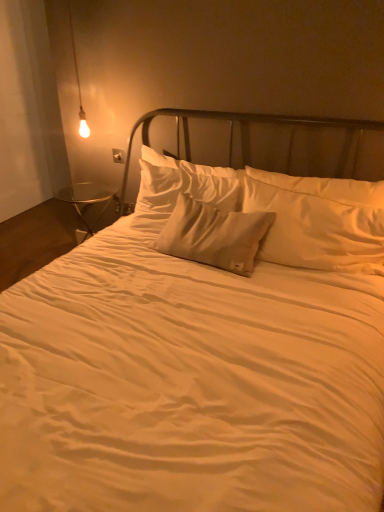
Find the location of a particular element. satin beige pillow at center, placed as the second pillow when sorted from back to front is located at coordinates (288, 212).

Image resolution: width=384 pixels, height=512 pixels. I want to click on matte plastic electric outlet at lower left, the 2th electric outlet viewed from the front, so click(128, 208).

How much space does white plastic electric outlet at upper left, which is the 1th electric outlet from front to back, occupy horizontally?

white plastic electric outlet at upper left, which is the 1th electric outlet from front to back, is 1.17 inches in width.

This screenshot has height=512, width=384. What are the coordinates of `white plastic electric outlet at upper left, the 2th electric outlet from the bottom` in the screenshot? It's located at (118, 156).

I want to click on matte glass bulb at upper left, so click(x=78, y=82).

Can you confirm if matte plastic electric outlet at lower left, the second electric outlet from the top, is bigger than satin beige pillow at center, placed as the second pillow when sorted from back to front?

No.

Is matte plastic electric outlet at lower left, placed as the 1th electric outlet when sorted from bottom to top, located outside satin beige pillow at center, which ranks as the first pillow in front-to-back order?

Indeed, matte plastic electric outlet at lower left, placed as the 1th electric outlet when sorted from bottom to top, is completely outside satin beige pillow at center, which ranks as the first pillow in front-to-back order.

Which object is thinner, matte plastic electric outlet at lower left, which is the 1th electric outlet in back-to-front order, or satin beige pillow at center, which ranks as the first pillow in front-to-back order?

matte plastic electric outlet at lower left, which is the 1th electric outlet in back-to-front order.

From the image's perspective, which object appears higher, matte plastic electric outlet at lower left, the second electric outlet from the top, or satin beige pillow at center, placed as the second pillow when sorted from back to front?

matte plastic electric outlet at lower left, the second electric outlet from the top.

Is matte glass bulb at upper left closer to the viewer compared to white plastic electric outlet at upper left, which ranks as the first electric outlet in top-to-bottom order?

That is True.

Considering the sizes of objects matte glass bulb at upper left and white plastic electric outlet at upper left, which ranks as the first electric outlet in top-to-bottom order, in the image provided, who is taller, matte glass bulb at upper left or white plastic electric outlet at upper left, which ranks as the first electric outlet in top-to-bottom order,?

matte glass bulb at upper left is taller.

In the scene shown: Which of these two, matte glass bulb at upper left or white plastic electric outlet at upper left, the 2th electric outlet viewed from the back, is bigger?

matte glass bulb at upper left.

From a real-world perspective, between white plastic electric outlet at upper left, the 2th electric outlet viewed from the back, and matte plastic electric outlet at lower left, the second electric outlet from the top, who is vertically higher?

white plastic electric outlet at upper left, the 2th electric outlet viewed from the back.

Which object is positioned more to the left, white plastic electric outlet at upper left, the 2th electric outlet from the bottom, or matte plastic electric outlet at lower left, which is the 1th electric outlet in back-to-front order?

From the viewer's perspective, white plastic electric outlet at upper left, the 2th electric outlet from the bottom, appears more on the left side.

Could you tell me if white plastic electric outlet at upper left, which is the 1th electric outlet from front to back, is turned towards matte plastic electric outlet at lower left, placed as the 1th electric outlet when sorted from bottom to top?

No, white plastic electric outlet at upper left, which is the 1th electric outlet from front to back, is not aimed at matte plastic electric outlet at lower left, placed as the 1th electric outlet when sorted from bottom to top.

Is matte plastic electric outlet at lower left, placed as the 1th electric outlet when sorted from bottom to top, completely or partially outside of white plastic electric outlet at upper left, the 2th electric outlet from the bottom?

Indeed, matte plastic electric outlet at lower left, placed as the 1th electric outlet when sorted from bottom to top, is completely outside white plastic electric outlet at upper left, the 2th electric outlet from the bottom.

Is matte plastic electric outlet at lower left, the second electric outlet from the top, facing towards white plastic electric outlet at upper left, the 2th electric outlet viewed from the back?

No, matte plastic electric outlet at lower left, the second electric outlet from the top, is not facing towards white plastic electric outlet at upper left, the 2th electric outlet viewed from the back.

Is matte plastic electric outlet at lower left, the second electric outlet from the top, thinner than white plastic electric outlet at upper left, the 2th electric outlet viewed from the back?

Correct, the width of matte plastic electric outlet at lower left, the second electric outlet from the top, is less than that of white plastic electric outlet at upper left, the 2th electric outlet viewed from the back.

From the image's perspective, between matte plastic electric outlet at lower left, which is the 1th electric outlet in back-to-front order, and white plastic electric outlet at upper left, the 2th electric outlet from the bottom, who is located below?

matte plastic electric outlet at lower left, which is the 1th electric outlet in back-to-front order, is shown below in the image.

Is white plastic electric outlet at upper left, the 2th electric outlet from the bottom, not near satin beige pillow at center, which ranks as the first pillow in front-to-back order?

No.

Considering the relative sizes of white plastic electric outlet at upper left, the 2th electric outlet from the bottom, and satin beige pillow at center, which ranks as the first pillow in front-to-back order, in the image provided, is white plastic electric outlet at upper left, the 2th electric outlet from the bottom, smaller than satin beige pillow at center, which ranks as the first pillow in front-to-back order,?

Yes, white plastic electric outlet at upper left, the 2th electric outlet from the bottom, is smaller than satin beige pillow at center, which ranks as the first pillow in front-to-back order.

Between white plastic electric outlet at upper left, the 2th electric outlet from the bottom, and satin beige pillow at center, which ranks as the first pillow in front-to-back order, which one appears on the right side from the viewer's perspective?

From the viewer's perspective, satin beige pillow at center, which ranks as the first pillow in front-to-back order, appears more on the right side.

Between white plastic electric outlet at upper left, which is the 1th electric outlet from front to back, and satin beige pillow at center, placed as the second pillow when sorted from back to front, which one has more height?

satin beige pillow at center, placed as the second pillow when sorted from back to front.

Which of these two, matte glass bulb at upper left or matte plastic electric outlet at lower left, placed as the 1th electric outlet when sorted from bottom to top, is smaller?

matte plastic electric outlet at lower left, placed as the 1th electric outlet when sorted from bottom to top.

From the image's perspective, starting from the matte glass bulb at upper left, which electric outlet is the 2nd one below? Please provide its 2D coordinates.

[(128, 208)]

Consider the image. Is matte glass bulb at upper left wider than matte plastic electric outlet at lower left, the 2th electric outlet viewed from the front?

Correct, the width of matte glass bulb at upper left exceeds that of matte plastic electric outlet at lower left, the 2th electric outlet viewed from the front.

Considering the positions of objects matte glass bulb at upper left and matte plastic electric outlet at lower left, placed as the 1th electric outlet when sorted from bottom to top, in the image provided, who is more to the left, matte glass bulb at upper left or matte plastic electric outlet at lower left, placed as the 1th electric outlet when sorted from bottom to top,?

Positioned to the left is matte glass bulb at upper left.

Locate an element on the screen. pillow beneath the satin beige pillow at center, the 1th pillow viewed from the back (from a real-world perspective) is located at coordinates (288, 212).

From the image's perspective, is satin beige pillow at center, placed as the 2th pillow when sorted from front to back, under satin beige pillow at center, which ranks as the first pillow in front-to-back order?

No, from the image's perspective, satin beige pillow at center, placed as the 2th pillow when sorted from front to back, is not below satin beige pillow at center, which ranks as the first pillow in front-to-back order.

Looking at this image, is satin beige pillow at center, the 1th pillow viewed from the back, taller than satin beige pillow at center, placed as the second pillow when sorted from back to front?

No.

Considering the positions of points (292, 203) and (355, 215), is point (292, 203) farther from camera compared to point (355, 215)?

Yes, point (292, 203) is behind point (355, 215).

From a real-world perspective, count 1st pillows upward from the matte plastic electric outlet at lower left, placed as the 1th electric outlet when sorted from bottom to top, and point to it. Please provide its 2D coordinates.

[(288, 212)]

Starting from the matte glass bulb at upper left, which electric outlet is the 1st one behind? Please provide its 2D coordinates.

[(118, 156)]

Estimate the real-world distances between objects in this image. Which object is closer to matte glass bulb at upper left, matte plastic electric outlet at lower left, placed as the 1th electric outlet when sorted from bottom to top, or white plastic electric outlet at upper left, which is the 1th electric outlet from front to back?

Based on the image, white plastic electric outlet at upper left, which is the 1th electric outlet from front to back, appears to be nearer to matte glass bulb at upper left.

Based on their spatial positions, is satin beige pillow at center, which ranks as the first pillow in front-to-back order, or matte glass bulb at upper left further from matte plastic electric outlet at lower left, which is the 1th electric outlet in back-to-front order?

satin beige pillow at center, which ranks as the first pillow in front-to-back order, is further to matte plastic electric outlet at lower left, which is the 1th electric outlet in back-to-front order.

From the image, which object appears to be farther from satin beige pillow at center, which ranks as the first pillow in front-to-back order, white plastic electric outlet at upper left, which is the 1th electric outlet from front to back, or matte glass bulb at upper left?

Based on the image, matte glass bulb at upper left appears to be further to satin beige pillow at center, which ranks as the first pillow in front-to-back order.

From the image, which object appears to be farther from white plastic electric outlet at upper left, the 2th electric outlet viewed from the back, satin beige pillow at center, placed as the 2th pillow when sorted from front to back, or matte plastic electric outlet at lower left, the 2th electric outlet viewed from the front?

satin beige pillow at center, placed as the 2th pillow when sorted from front to back, is positioned further to the anchor white plastic electric outlet at upper left, the 2th electric outlet viewed from the back.

Looking at the image, which one is located closer to white plastic electric outlet at upper left, which ranks as the first electric outlet in top-to-bottom order, matte glass bulb at upper left or satin beige pillow at center, placed as the 2th pillow when sorted from front to back?

Based on the image, matte glass bulb at upper left appears to be nearer to white plastic electric outlet at upper left, which ranks as the first electric outlet in top-to-bottom order.

From the picture: Considering their positions, is matte glass bulb at upper left positioned further to satin beige pillow at center, which ranks as the first pillow in front-to-back order, than matte plastic electric outlet at lower left, the 2th electric outlet viewed from the front?

matte glass bulb at upper left is further to satin beige pillow at center, which ranks as the first pillow in front-to-back order.

Considering their positions, is white plastic electric outlet at upper left, the 2th electric outlet from the bottom, positioned further to satin beige pillow at center, the 1th pillow viewed from the back, than matte glass bulb at upper left?

Among the two, matte glass bulb at upper left is located further to satin beige pillow at center, the 1th pillow viewed from the back.

Which object lies nearer to the anchor point matte plastic electric outlet at lower left, the second electric outlet from the top, matte glass bulb at upper left or satin beige pillow at center, the 1th pillow viewed from the back?

Among the two, matte glass bulb at upper left is located nearer to matte plastic electric outlet at lower left, the second electric outlet from the top.

This screenshot has height=512, width=384. In order to click on lamp between satin beige pillow at center, which ranks as the first pillow in front-to-back order, and matte plastic electric outlet at lower left, the 2th electric outlet viewed from the front, along the z-axis in this screenshot , I will do `click(78, 82)`.

Locate an element on the screen. electric outlet between satin beige pillow at center, placed as the second pillow when sorted from back to front, and matte plastic electric outlet at lower left, the 2th electric outlet viewed from the front, from front to back is located at coordinates (118, 156).

This screenshot has width=384, height=512. I want to click on electric outlet located between matte glass bulb at upper left and matte plastic electric outlet at lower left, the 2th electric outlet viewed from the front, in the depth direction, so click(118, 156).

I want to click on pillow between white plastic electric outlet at upper left, which ranks as the first electric outlet in top-to-bottom order, and satin beige pillow at center, the 1th pillow viewed from the back, in the horizontal direction, so click(x=288, y=212).